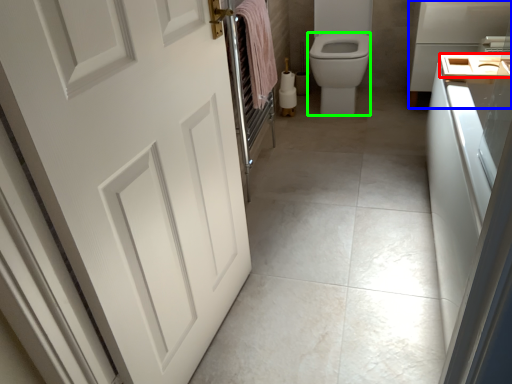
Question: Based on their relative distances, which object is farther from sink (highlighted by a red box)? Choose from appliance (highlighted by a blue box) and bidet (highlighted by a green box).

Choices:
 (A) appliance
 (B) bidet

Answer: (B)